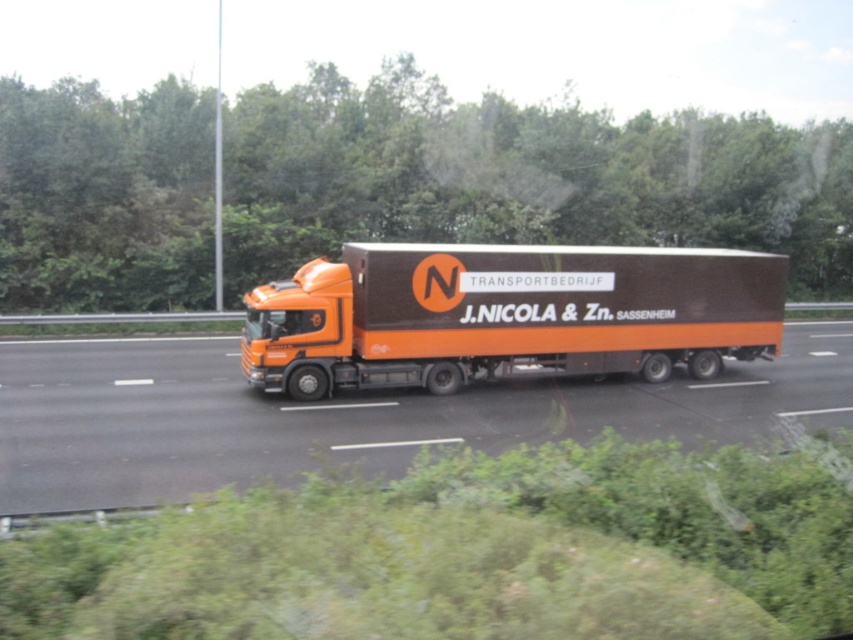
Question: Is orange matte truck at center to the left of orange matte trailer truck at center from the viewer's perspective?

Choices:
 (A) yes
 (B) no

Answer: (A)

Question: Is orange matte truck at center to the right of orange matte trailer truck at center from the viewer's perspective?

Choices:
 (A) yes
 (B) no

Answer: (B)

Question: Does orange matte truck at center have a lesser width compared to orange matte trailer truck at center?

Choices:
 (A) no
 (B) yes

Answer: (B)

Question: Which point appears farthest from the camera in this image?

Choices:
 (A) (376, 317)
 (B) (519, 432)

Answer: (A)

Question: Which of the following is the farthest from the observer?

Choices:
 (A) orange matte trailer truck at center
 (B) orange matte truck at center

Answer: (A)